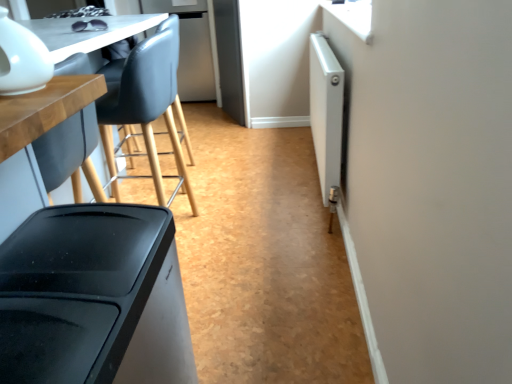
Question: Is matte wood table at left outside white glossy teapot at upper left, marked as the first appliance in a front-to-back arrangement?

Choices:
 (A) yes
 (B) no

Answer: (A)

Question: Is matte wood table at left in front of white glossy teapot at upper left, marked as the first appliance in a front-to-back arrangement?

Choices:
 (A) no
 (B) yes

Answer: (B)

Question: From a real-world perspective, is matte wood table at left physically below white glossy teapot at upper left, which is counted as the 1th appliance, starting from the left?

Choices:
 (A) yes
 (B) no

Answer: (A)

Question: Can you confirm if matte wood table at left is bigger than white glossy teapot at upper left, which is the 2th appliance in back-to-front order?

Choices:
 (A) no
 (B) yes

Answer: (B)

Question: Is matte wood table at left positioned with its back to white glossy teapot at upper left, which is counted as the 1th appliance, starting from the left?

Choices:
 (A) yes
 (B) no

Answer: (B)

Question: Based on their sizes in the image, would you say white metallic radiator at right, placed as the 2th appliance when sorted from front to back, is bigger or smaller than matte wood table at left?

Choices:
 (A) big
 (B) small

Answer: (B)

Question: From their relative heights in the image, would you say white metallic radiator at right, which is the 2th appliance from left to right, is taller or shorter than matte wood table at left?

Choices:
 (A) short
 (B) tall

Answer: (A)

Question: From a real-world perspective, is white metallic radiator at right, placed as the 2th appliance when sorted from front to back, above or below matte wood table at left?

Choices:
 (A) below
 (B) above

Answer: (A)

Question: Relative to matte wood table at left, is white metallic radiator at right, which is the first appliance in right-to-left order, in front or behind?

Choices:
 (A) front
 (B) behind

Answer: (B)

Question: Considering the positions of white glossy teapot at upper left, marked as the first appliance in a front-to-back arrangement, and matte wood table at left in the image, is white glossy teapot at upper left, marked as the first appliance in a front-to-back arrangement, bigger or smaller than matte wood table at left?

Choices:
 (A) small
 (B) big

Answer: (A)

Question: In terms of height, does white glossy teapot at upper left, which is the 2th appliance in back-to-front order, look taller or shorter compared to matte wood table at left?

Choices:
 (A) tall
 (B) short

Answer: (B)

Question: Relative to matte wood table at left, is white glossy teapot at upper left, which is the 2th appliance in back-to-front order, in front or behind?

Choices:
 (A) front
 (B) behind

Answer: (B)

Question: From a real-world perspective, is white glossy teapot at upper left, marked as the first appliance in a front-to-back arrangement, positioned above or below matte wood table at left?

Choices:
 (A) above
 (B) below

Answer: (A)

Question: Is white glossy teapot at upper left, which is the 2th appliance in back-to-front order, inside or outside of white metallic radiator at right, which is the 2th appliance from left to right?

Choices:
 (A) inside
 (B) outside

Answer: (B)

Question: From their relative heights in the image, would you say white glossy teapot at upper left, the second appliance viewed from the right, is taller or shorter than white metallic radiator at right, the first appliance from the back?

Choices:
 (A) short
 (B) tall

Answer: (A)